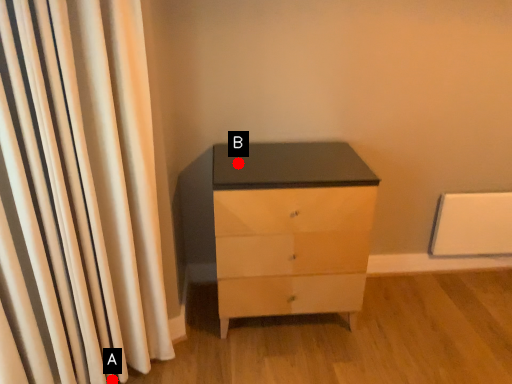
Question: Two points are circled on the image, labeled by A and B beside each circle. Which point is farther from the camera taking this photo?

Choices:
 (A) A is further
 (B) B is further

Answer: (B)